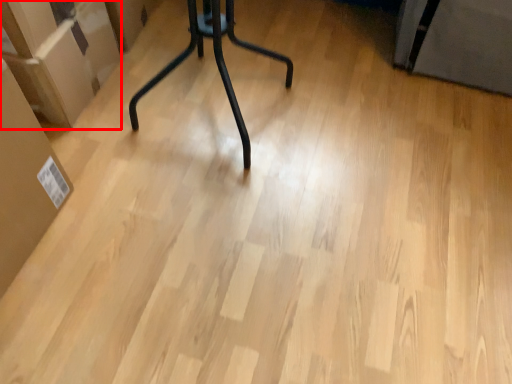
Question: From the image, what is the correct spatial relationship of cardboard box (annotated by the red box) in relation to cardboard box?

Choices:
 (A) right
 (B) left

Answer: (B)